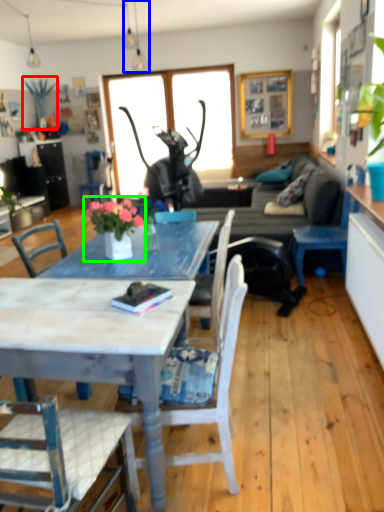
Question: Based on their relative distances, which object is nearer to plant (highlighted by a red box)? Choose from lamp (highlighted by a blue box) and houseplant (highlighted by a green box).

Choices:
 (A) lamp
 (B) houseplant

Answer: (A)